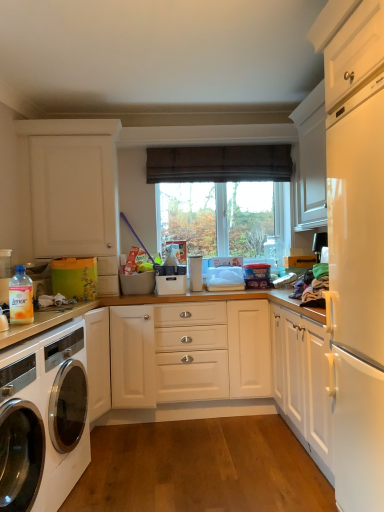
Identify the location of white matte cabinet at upper left. Image resolution: width=384 pixels, height=512 pixels. (71, 192).

This screenshot has width=384, height=512. Identify the location of translucent plastic bottle at lower left. (21, 297).

This screenshot has width=384, height=512. Find the location of `white plastic container at center`. white plastic container at center is located at coordinates (195, 272).

The height and width of the screenshot is (512, 384). I want to click on transparent glass window at center, so tap(218, 217).

Locate an element on the screen. This screenshot has height=512, width=384. white matte cabinet at upper left is located at coordinates (71, 192).

Which is closer, (192, 269) or (60, 495)?

Point (60, 495)

Who is taller, white plastic container at center or white glossy washing machine at lower left?

white glossy washing machine at lower left is taller.

Are white plastic container at center and white glossy washing machine at lower left far apart?

Yes, white plastic container at center is far from white glossy washing machine at lower left.

Considering the relative sizes of white glossy washing machine at lower left and translucent plastic bottle at lower left in the image provided, is white glossy washing machine at lower left bigger than translucent plastic bottle at lower left?

Yes.

In the image, is white glossy washing machine at lower left on the left side or the right side of translucent plastic bottle at lower left?

In the image, white glossy washing machine at lower left appears on the left side of translucent plastic bottle at lower left.

Looking at this image, from the image's perspective, which is below, white glossy washing machine at lower left or translucent plastic bottle at lower left?

From the image's view, white glossy washing machine at lower left is below.

In the scene shown: Would you say white glossy washing machine at lower left is a long distance from translucent plastic bottle at lower left?

white glossy washing machine at lower left is near translucent plastic bottle at lower left, not far away.

Would you say transparent glass window at center is a long distance from white matte cabinet at upper left?

No, transparent glass window at center is not far from white matte cabinet at upper left.

Considering the positions of objects transparent glass window at center and white matte cabinet at upper left in the image provided, who is behind, transparent glass window at center or white matte cabinet at upper left?

transparent glass window at center is further from the camera.

From the picture: Can we say transparent glass window at center lies outside white matte cabinet at upper left?

That's correct, transparent glass window at center is outside of white matte cabinet at upper left.

Does transparent glass window at center have a smaller size compared to white matte cabinet at upper left?

Yes, transparent glass window at center is smaller than white matte cabinet at upper left.

From the picture: Does transparent glass window at center come in front of translucent plastic bottle at lower left?

No, transparent glass window at center is behind translucent plastic bottle at lower left.

Can you confirm if transparent glass window at center is bigger than translucent plastic bottle at lower left?

Correct, transparent glass window at center is larger in size than translucent plastic bottle at lower left.

Is transparent glass window at center taller than translucent plastic bottle at lower left?

Indeed, transparent glass window at center has a greater height compared to translucent plastic bottle at lower left.

Is the depth of white plastic container at center greater than that of translucent plastic bottle at lower left?

Yes, it is.

Considering the relative sizes of white plastic container at center and translucent plastic bottle at lower left in the image provided, is white plastic container at center wider than translucent plastic bottle at lower left?

Indeed, white plastic container at center has a greater width compared to translucent plastic bottle at lower left.

Based on the photo, is white plastic container at center oriented away from translucent plastic bottle at lower left?

That's not correct — white plastic container at center is not looking away from translucent plastic bottle at lower left.

From a real-world perspective, is white plastic container at center above or below translucent plastic bottle at lower left?

In terms of real-world spatial position, white plastic container at center is below translucent plastic bottle at lower left.

In the scene shown: Can you confirm if white matte cabinet at upper left is positioned to the left of brown fabric curtain at center?

Yes.

What's the angular difference between white matte cabinet at upper left and brown fabric curtain at center's facing directions?

The facing directions of white matte cabinet at upper left and brown fabric curtain at center are 3.67 degrees apart.

Can you confirm if white matte cabinet at upper left is taller than brown fabric curtain at center?

Indeed, white matte cabinet at upper left has a greater height compared to brown fabric curtain at center.

From the image's perspective, is translucent plastic bottle at lower left under white matte cabinet at upper left?

Yes.

Which object is positioned more to the left, translucent plastic bottle at lower left or white matte cabinet at upper left?

white matte cabinet at upper left.

How different are the orientations of translucent plastic bottle at lower left and white matte cabinet at upper left in degrees?

They differ by 6.52 degrees in their facing directions.

Which is behind, point (21, 282) or point (88, 187)?

Point (88, 187)

Identify the location of appliance that appears behind the white glossy washing machine at lower left. This screenshot has width=384, height=512. (195, 272).

The width and height of the screenshot is (384, 512). What are the coordinates of `washing machine below the translucent plastic bottle at lower left (from a real-world perspective)` in the screenshot? It's located at (43, 420).

Considering their positions, is white glossy washing machine at lower left positioned closer to transparent glass window at center than brown fabric curtain at center?

Among the two, brown fabric curtain at center is located nearer to transparent glass window at center.

From the image, which object appears to be farther from white plastic container at center, translucent plastic bottle at lower left or transparent glass window at center?

→ translucent plastic bottle at lower left is further to white plastic container at center.

Looking at the image, which one is located closer to brown fabric curtain at center, white matte cabinet at upper left or translucent plastic bottle at lower left?

white matte cabinet at upper left lies closer to brown fabric curtain at center than the other object.

Estimate the real-world distances between objects in this image. Which object is further from white plastic container at center, translucent plastic bottle at lower left or brown fabric curtain at center?

translucent plastic bottle at lower left lies further to white plastic container at center than the other object.

When comparing their distances from white matte cabinet at upper left, does brown fabric curtain at center or white plastic container at center seem closer?

The object closer to white matte cabinet at upper left is brown fabric curtain at center.

When comparing their distances from translucent plastic bottle at lower left, does transparent glass window at center or white matte cabinet at upper left seem closer?

The object closer to translucent plastic bottle at lower left is white matte cabinet at upper left.

From the image, which object appears to be farther from white matte cabinet at upper left, white plastic container at center or white glossy washing machine at lower left?

The object further to white matte cabinet at upper left is white glossy washing machine at lower left.

Considering their positions, is brown fabric curtain at center positioned further to translucent plastic bottle at lower left than white plastic container at center?

brown fabric curtain at center.

You are a GUI agent. You are given a task and a screenshot of the screen. Output one action in this format:
    pyautogui.click(x=<x>, y=<y>)
    Task: Click on the curtain between white glossy washing machine at lower left and transparent glass window at center along the z-axis
    The width and height of the screenshot is (384, 512).
    Given the screenshot: What is the action you would take?
    pyautogui.click(x=219, y=164)

Where is `cabinetry located between white glossy washing machine at lower left and transparent glass window at center in the depth direction`? The image size is (384, 512). cabinetry located between white glossy washing machine at lower left and transparent glass window at center in the depth direction is located at coordinates (71, 192).

At what (x,y) coordinates should I click in order to perform the action: click on appliance between white glossy washing machine at lower left and transparent glass window at center in the front-back direction. Please return your answer as a coordinate pair (x, y). This screenshot has height=512, width=384. Looking at the image, I should click on (195, 272).

I want to click on appliance located between white matte cabinet at upper left and transparent glass window at center in the left-right direction, so click(195, 272).